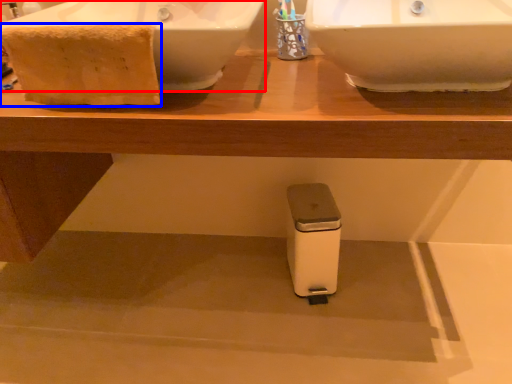
Question: Which point is further to the camera, sink (highlighted by a red box) or material (highlighted by a blue box)?

Choices:
 (A) sink
 (B) material

Answer: (B)